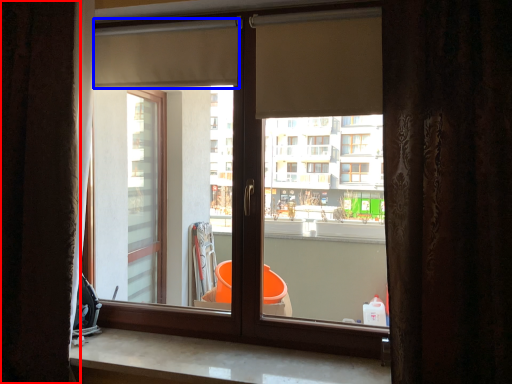
Question: Which of the following is the closest to the observer, curtain (highlighted by a red box) or shutter (highlighted by a blue box)?

Choices:
 (A) curtain
 (B) shutter

Answer: (A)